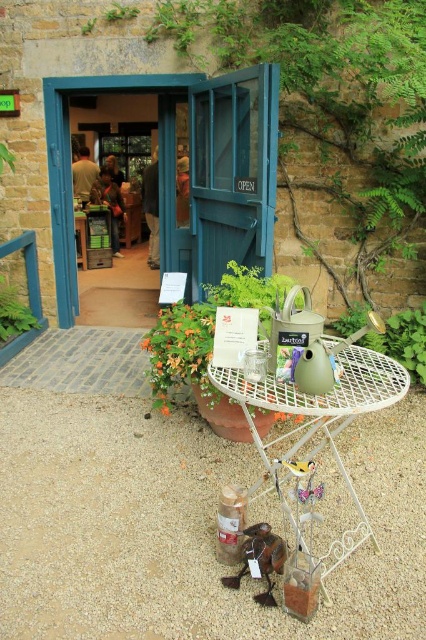
Does green matte watering can at center appear under green leafy plant at center?

Indeed, green matte watering can at center is positioned under green leafy plant at center.

Is green matte watering can at center thinner than green leafy plant at center?

Yes, green matte watering can at center is thinner than green leafy plant at center.

Describe the element at coordinates (322, 422) in the screenshot. I see `green matte watering can at center` at that location.

Locate an element on the screen. The image size is (426, 640). green matte watering can at center is located at coordinates (322, 422).

Is blue wooden door at center shorter than green matte watering can at center-right?

No.

Does blue wooden door at center appear over green matte watering can at center-right?

Indeed, blue wooden door at center is positioned over green matte watering can at center-right.

Find the location of a particular element. This screenshot has height=640, width=426. blue wooden door at center is located at coordinates (189, 172).

The width and height of the screenshot is (426, 640). Identify the location of blue wooden door at center. (189, 172).

Is green matte watering can at center smaller than green leafy plant at lower left?

No, green matte watering can at center is not smaller than green leafy plant at lower left.

Does green matte watering can at center have a greater height compared to green leafy plant at lower left?

Indeed, green matte watering can at center has a greater height compared to green leafy plant at lower left.

What are the coordinates of `green matte watering can at center` in the screenshot? It's located at (322, 422).

Where is `green matte watering can at center`? The height and width of the screenshot is (640, 426). green matte watering can at center is located at coordinates (322, 422).